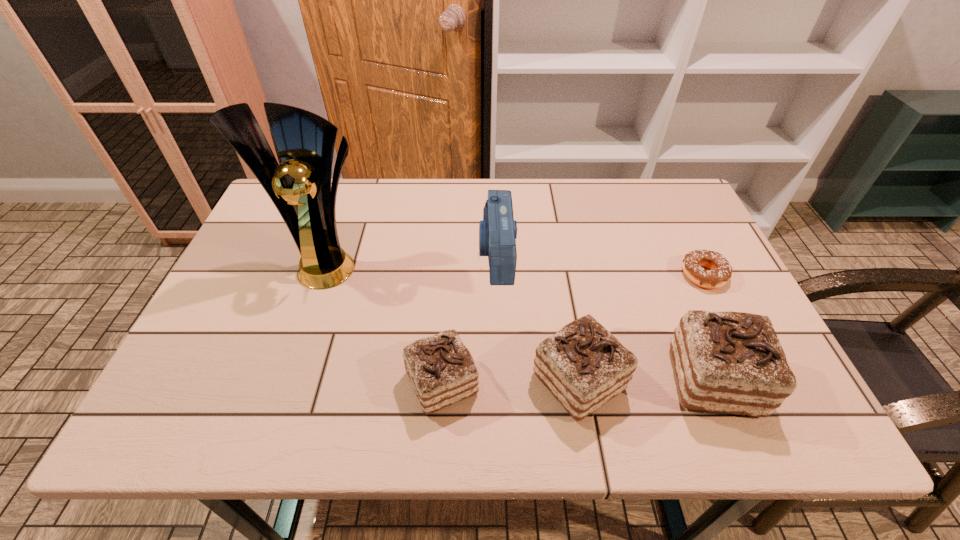
Locate an element on the screen. doughnut present at the right edge is located at coordinates (720, 272).

This screenshot has width=960, height=540. What are the coordinates of `object that is at the near right corner` in the screenshot? It's located at (733, 362).

Where is `vacant space at the far edge of the desktop`? This screenshot has height=540, width=960. vacant space at the far edge of the desktop is located at coordinates (371, 198).

In the image, there is a desktop. At what (x,y) coordinates should I click in order to perform the action: click on vacant space at the near edge. Please return your answer as a coordinate pair (x, y). The height and width of the screenshot is (540, 960). Looking at the image, I should click on (647, 361).

In the image, there is a desktop. Where is `vacant area at the left edge`? vacant area at the left edge is located at coordinates (274, 309).

Locate an element on the screen. vacant space at the far right corner is located at coordinates (653, 185).

The image size is (960, 540). In order to click on free area in between the fifth tallest object and the award in this screenshot , I will do `click(385, 322)`.

Where is `vacant area that lies between the tallest object and the second chocolate cake from left to right`? Image resolution: width=960 pixels, height=540 pixels. vacant area that lies between the tallest object and the second chocolate cake from left to right is located at coordinates (453, 321).

This screenshot has width=960, height=540. In order to click on vacant point located between the leftmost chocolate cake and the award in this screenshot , I will do `click(385, 322)`.

What are the coordinates of `free space between the award and the second chocolate cake from left to right` in the screenshot? It's located at (453, 321).